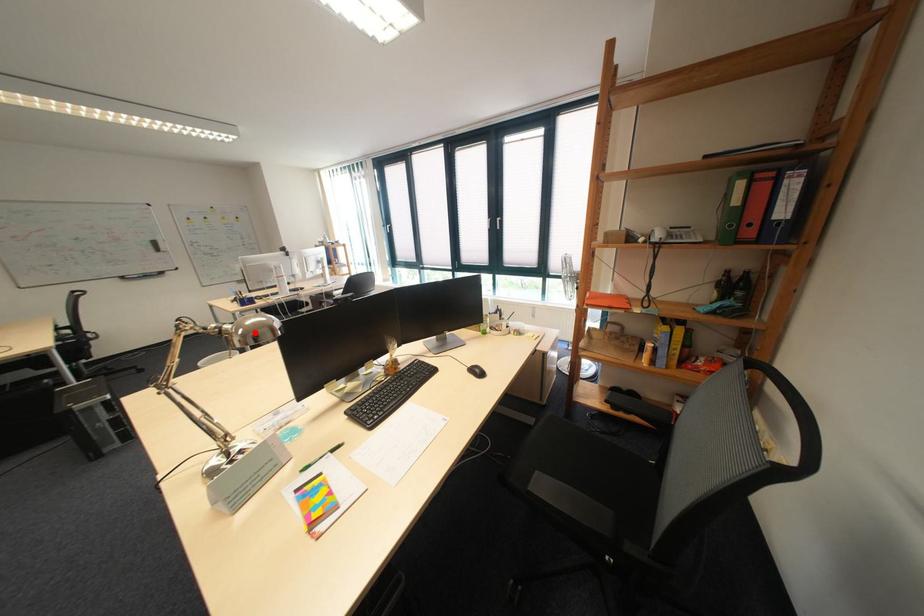
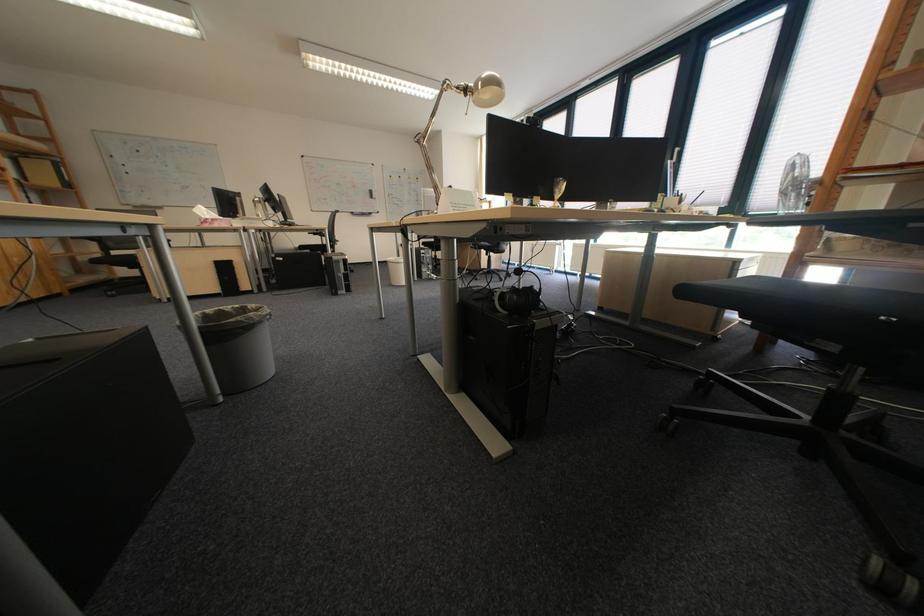
The point at the highlighted location is marked in the first image. Where is the corresponding point in the second image?

(495, 84)